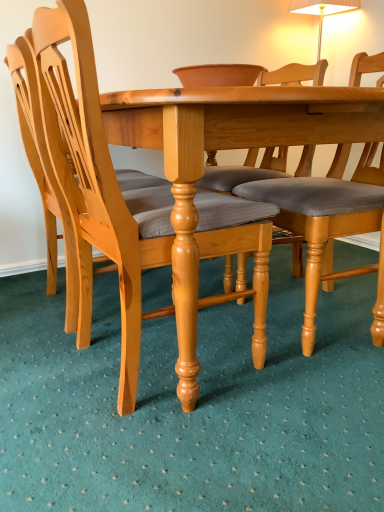
Question: Is the depth of light brown wood chair at left, placed as the second chair when sorted from right to left, less than that of light wood chair at left, the third chair when ordered from right to left?

Choices:
 (A) no
 (B) yes

Answer: (B)

Question: Does light brown wood chair at left, acting as the second chair starting from the left, have a greater height compared to light wood chair at left, the third chair when ordered from right to left?

Choices:
 (A) no
 (B) yes

Answer: (B)

Question: From a real-world perspective, is light brown wood chair at left, placed as the second chair when sorted from right to left, on top of light wood chair at left, the third chair when ordered from right to left?

Choices:
 (A) no
 (B) yes

Answer: (A)

Question: Is light brown wood chair at left, acting as the second chair starting from the left, smaller than light wood chair at left, which is counted as the 1th chair, starting from the left?

Choices:
 (A) no
 (B) yes

Answer: (A)

Question: Could you tell me if light brown wood chair at left, placed as the second chair when sorted from right to left, is turned towards light wood chair at left, which is counted as the 1th chair, starting from the left?

Choices:
 (A) no
 (B) yes

Answer: (A)

Question: Is light brown wood chair at left, placed as the second chair when sorted from right to left, to the right of light wood chair at left, which is counted as the 1th chair, starting from the left, from the viewer's perspective?

Choices:
 (A) no
 (B) yes

Answer: (B)

Question: From the image's perspective, is light brown wood chair at left, acting as the second chair starting from the left, below light brown wood chair at center, the 3th chair when ordered from left to right?

Choices:
 (A) no
 (B) yes

Answer: (B)

Question: Considering the relative sizes of light brown wood chair at left, acting as the second chair starting from the left, and light brown wood chair at center, the 3th chair when ordered from left to right, in the image provided, is light brown wood chair at left, acting as the second chair starting from the left, wider than light brown wood chair at center, the 3th chair when ordered from left to right,?

Choices:
 (A) no
 (B) yes

Answer: (A)

Question: Is light brown wood chair at left, acting as the second chair starting from the left, directly adjacent to light brown wood chair at center, the 3th chair when ordered from left to right?

Choices:
 (A) no
 (B) yes

Answer: (A)

Question: Can you confirm if light brown wood chair at left, acting as the second chair starting from the left, is smaller than light brown wood chair at center, the 1th chair viewed from the right?

Choices:
 (A) no
 (B) yes

Answer: (A)

Question: Does light brown wood chair at left, placed as the second chair when sorted from right to left, have a lesser height compared to light brown wood chair at center, the 3th chair when ordered from left to right?

Choices:
 (A) no
 (B) yes

Answer: (A)

Question: From a real-world perspective, is light brown wood chair at left, acting as the second chair starting from the left, positioned under light brown wood chair at center, the 3th chair when ordered from left to right, based on gravity?

Choices:
 (A) yes
 (B) no

Answer: (A)

Question: Is light brown wood chair at center, the 1th chair viewed from the right, taller than light brown wood chair at left, placed as the second chair when sorted from right to left?

Choices:
 (A) no
 (B) yes

Answer: (A)